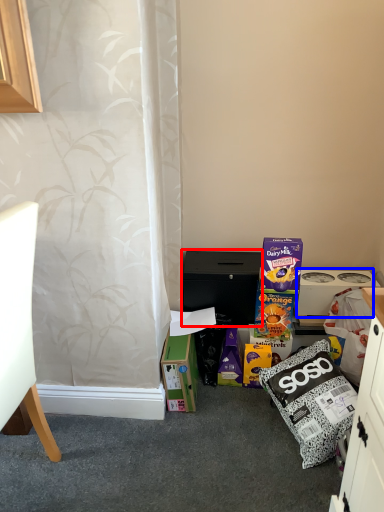
Question: Which object appears closest to the camera in this image, cabinetry (highlighted by a red box) or appliance (highlighted by a blue box)?

Choices:
 (A) cabinetry
 (B) appliance

Answer: (A)